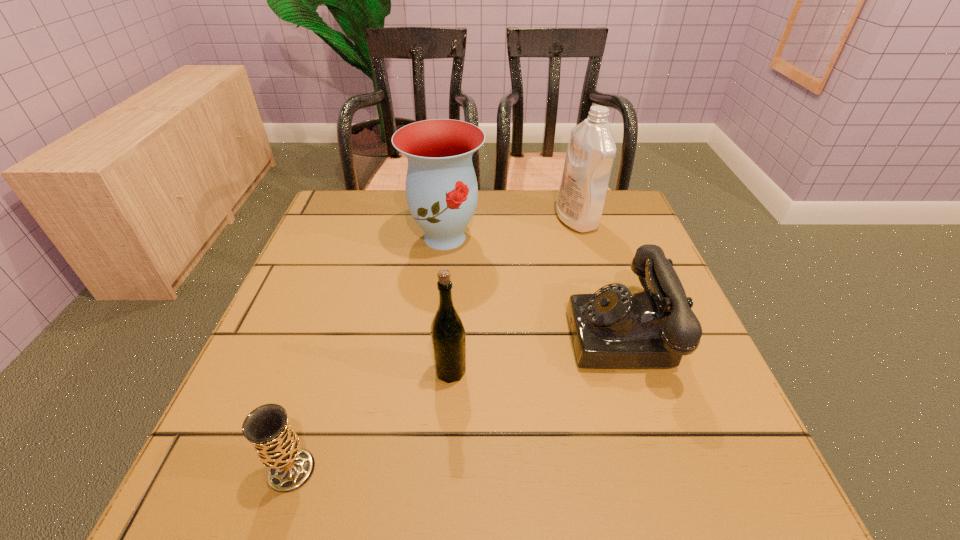
Find the location of a particular element. object positioned at the far right corner is located at coordinates (591, 150).

This screenshot has width=960, height=540. Identify the location of vacant space at the far edge of the desktop. tap(505, 191).

This screenshot has height=540, width=960. What are the coordinates of `vacant region at the near edge of the desktop` in the screenshot? It's located at (361, 457).

Locate an element on the screen. The image size is (960, 540). free space at the left edge is located at coordinates (213, 443).

What are the coordinates of `vacant space at the right edge` in the screenshot? It's located at (674, 406).

This screenshot has width=960, height=540. Identify the location of vacant space at the far left corner. (379, 217).

Image resolution: width=960 pixels, height=540 pixels. Identify the location of free space between the shortest object and the second shortest object. 458,402.

Where is `free point between the second shortest object and the detergent`? The width and height of the screenshot is (960, 540). free point between the second shortest object and the detergent is located at coordinates (601, 276).

Image resolution: width=960 pixels, height=540 pixels. In order to click on free space between the telephone and the detergent in this screenshot , I will do `click(601, 276)`.

I want to click on vacant space that's between the leftmost object and the second shortest object, so click(x=458, y=402).